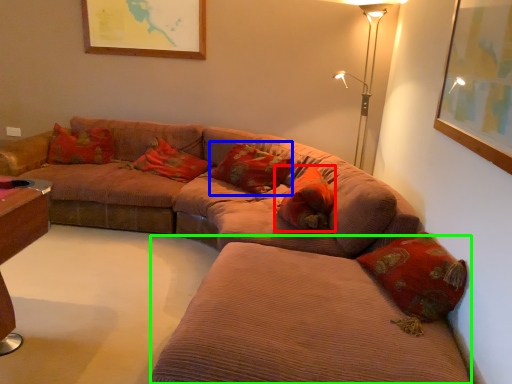
Question: Based on their relative distances, which object is nearer to pillow (highlighted by a red box)? Choose from pillow (highlighted by a blue box) and couch (highlighted by a green box).

Choices:
 (A) pillow
 (B) couch

Answer: (A)